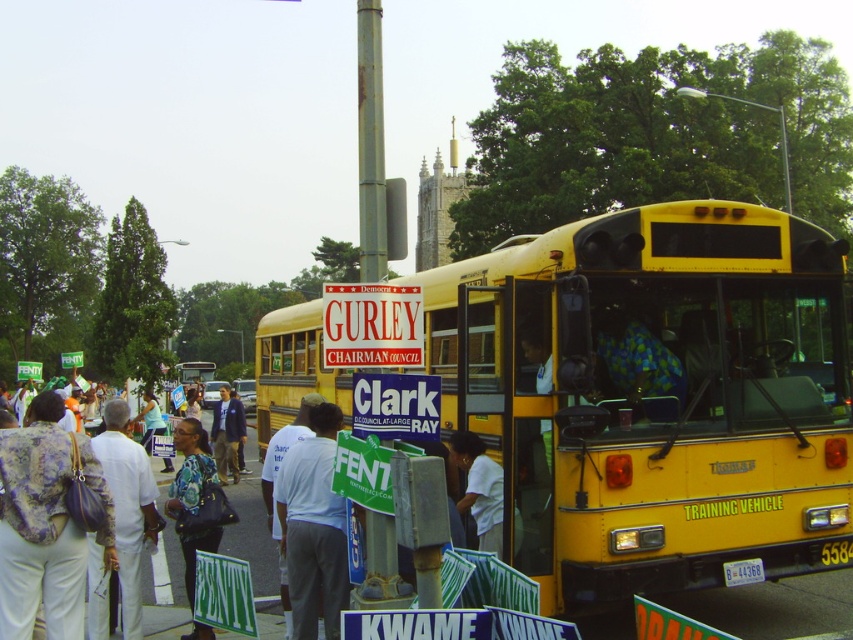
Question: Which point appears closest to the camera in this image?

Choices:
 (A) [605, 371]
 (B) [189, 506]
 (C) [817, 269]
 (D) [16, 468]

Answer: (D)

Question: Which object is closer to the camera taking this photo?

Choices:
 (A) white fabric sign at lower left
 (B) dark blue fabric jacket at center
 (C) blue-green checkered shirt at center
 (D) patterned fabric shirt at center

Answer: (A)

Question: In this image, where is white fabric shirt at center located relative to white plastic sign at center?

Choices:
 (A) above
 (B) below

Answer: (B)

Question: In this image, where is white fabric sign at lower left located relative to white fabric shirt at left?

Choices:
 (A) above
 (B) below

Answer: (A)

Question: Which point is farther to the camera?

Choices:
 (A) (717, 422)
 (B) (236, 401)
 (C) (482, 550)

Answer: (B)

Question: Is blue-green checkered shirt at center further to the viewer compared to white cotton shirt at center?

Choices:
 (A) yes
 (B) no

Answer: (A)